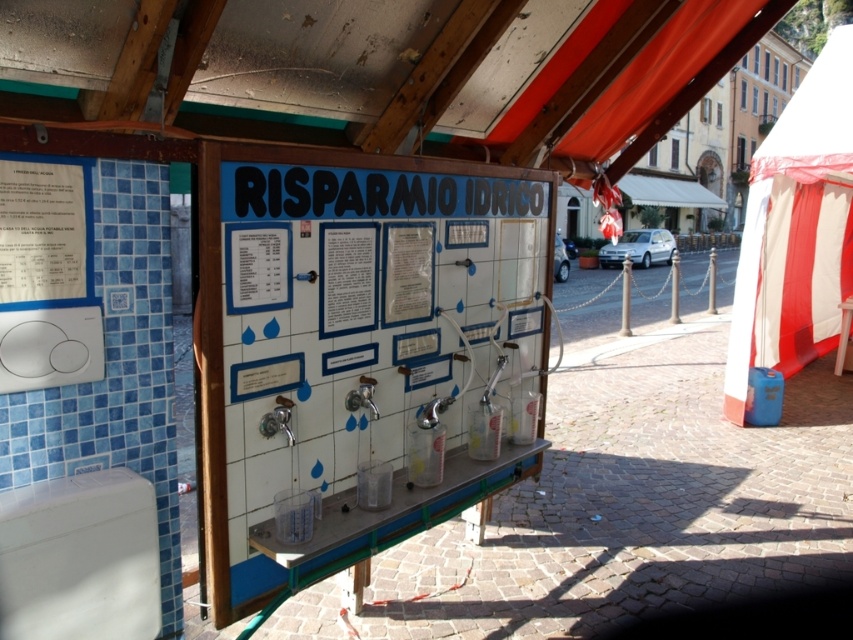
You are at the water station and need to place both the white tile board at center and the white paper at left on a shelf that can only hold one large item. Which one should you choose to fit?

The white tile board at center is bigger than the white paper at left, so you should choose the white tile board at center to fit on the shelf since it takes up more space.

You are looking at the water station and need to locate the white paper at left and the white tile board at center. According to their positions, which object is on the left side?

The white paper at left is on the left side because the white tile board at center is positioned on the right side of it.